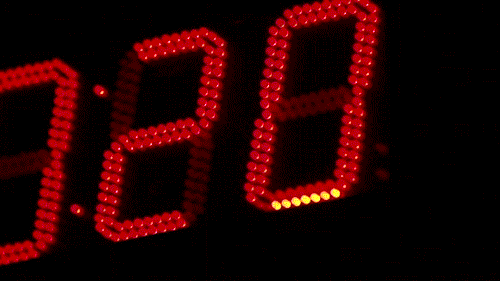
The image size is (500, 281). I want to click on title "tuesday" written on whiteboard, so click(162, 35).